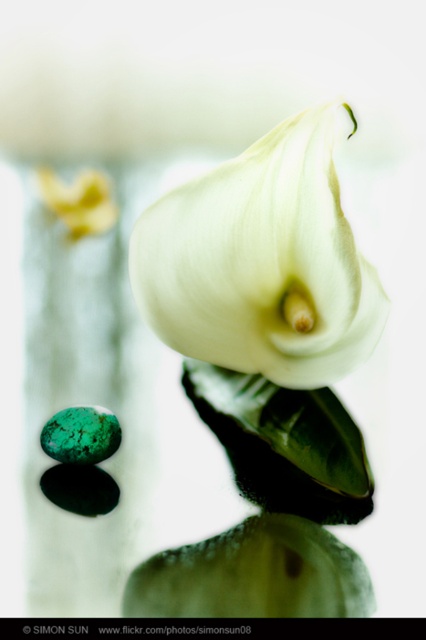
Question: Which of the following is the closest to the observer?

Choices:
 (A) emerald-green polished stone at lower left
 (B) white matte calla lily at center

Answer: (B)

Question: Can you confirm if white matte calla lily at center is smaller than emerald-green polished stone at lower left?

Choices:
 (A) yes
 (B) no

Answer: (B)

Question: Among these points, which one is nearest to the camera?

Choices:
 (A) (305, 253)
 (B) (52, 435)

Answer: (B)

Question: Observing the image, what is the correct spatial positioning of white matte calla lily at center in reference to emerald-green polished stone at lower left?

Choices:
 (A) above
 (B) below

Answer: (A)

Question: Can you confirm if white matte calla lily at center is positioned above emerald-green polished stone at lower left?

Choices:
 (A) no
 (B) yes

Answer: (B)